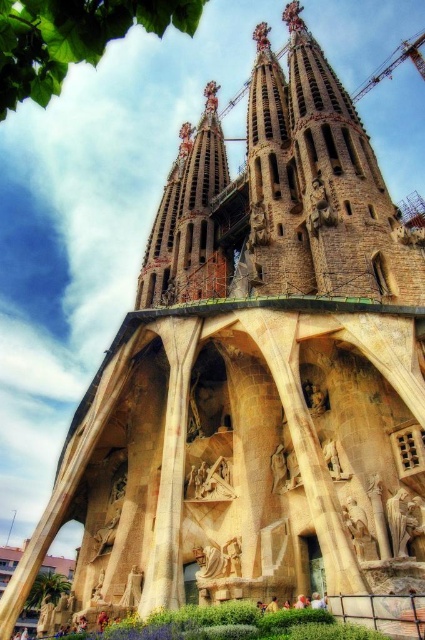
Question: Does wooden carving at center appear on the right side of stone statue at center?

Choices:
 (A) yes
 (B) no

Answer: (B)

Question: Among these points, which one is nearest to the camera?

Choices:
 (A) (345, 524)
 (B) (195, 472)

Answer: (A)

Question: Which point appears farthest from the camera in this image?

Choices:
 (A) (195, 492)
 (B) (354, 513)

Answer: (A)

Question: Is wooden carving at center smaller than stone statue at center?

Choices:
 (A) no
 (B) yes

Answer: (A)

Question: Can you confirm if wooden carving at center is thinner than stone statue at center?

Choices:
 (A) no
 (B) yes

Answer: (A)

Question: Which of the following is the farthest from the observer?

Choices:
 (A) stone statue at center
 (B) wooden carving at center

Answer: (B)